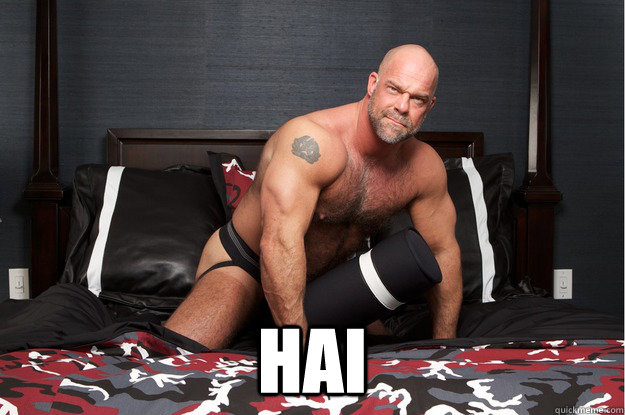
The width and height of the screenshot is (625, 415). What are the coordinates of `bed columns` in the screenshot? It's located at (48, 98), (541, 81).